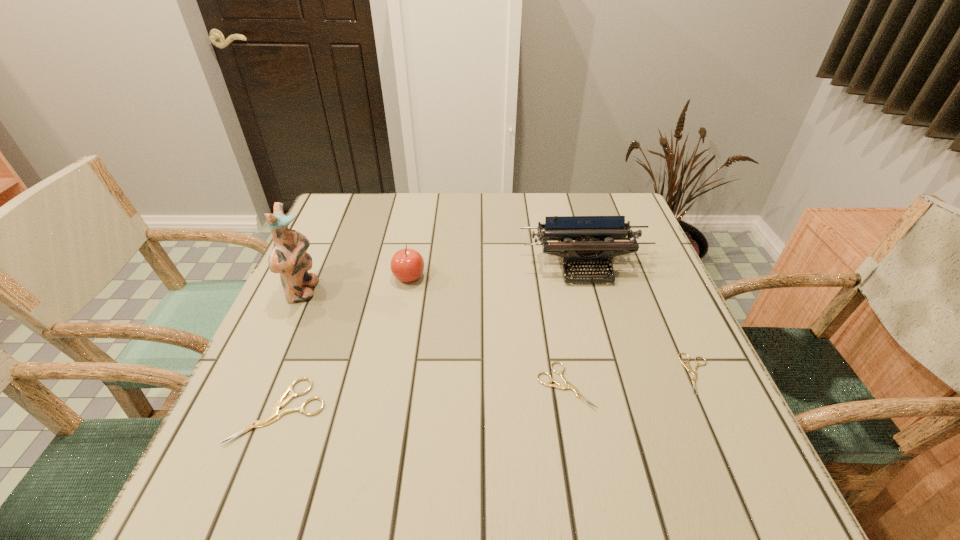
Locate an element on the screen. The height and width of the screenshot is (540, 960). object that is at the near left corner is located at coordinates (275, 413).

The width and height of the screenshot is (960, 540). In the image, there is a desktop. What are the coordinates of `vacant space at the far edge` in the screenshot? It's located at (493, 234).

Locate an element on the screen. This screenshot has width=960, height=540. vacant space at the near edge of the desktop is located at coordinates (450, 408).

Locate an element on the screen. vacant space at the left edge of the desktop is located at coordinates (333, 264).

At what (x,y) coordinates should I click in order to perform the action: click on free spot at the far right corner of the desktop. Please return your answer as a coordinate pair (x, y). The height and width of the screenshot is (540, 960). Looking at the image, I should click on (612, 195).

Locate an element on the screen. The height and width of the screenshot is (540, 960). vacant space at the near right corner of the desktop is located at coordinates (722, 441).

Find the location of a particular element. blank region between the third tallest object and the figurine is located at coordinates (356, 284).

I want to click on vacant space that is in between the fourth object from right to left and the second shears from left to right, so click(x=487, y=331).

Find the location of a particular element. unoccupied position between the typewriter and the second tallest shears is located at coordinates (574, 326).

In order to click on empty location between the third tallest object and the shortest object in this screenshot , I will do `click(553, 325)`.